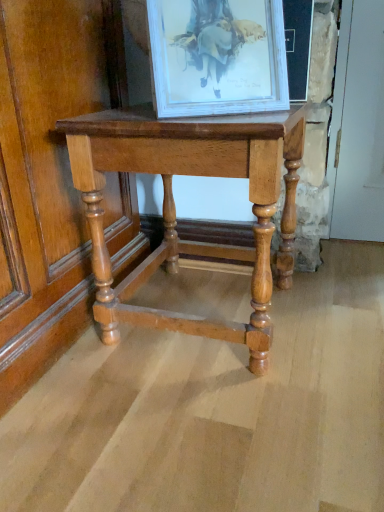
Question: In terms of size, does polished wood table at center appear bigger or smaller than white glossy picture frame at upper center?

Choices:
 (A) small
 (B) big

Answer: (B)

Question: From the image's perspective, is polished wood table at center located above or below white glossy picture frame at upper center?

Choices:
 (A) below
 (B) above

Answer: (A)

Question: Is polished wood table at center to the left or to the right of white glossy picture frame at upper center in the image?

Choices:
 (A) left
 (B) right

Answer: (A)

Question: Relative to polished wood table at center, is white glossy picture frame at upper center in front or behind?

Choices:
 (A) front
 (B) behind

Answer: (A)

Question: Considering the positions of white glossy picture frame at upper center and polished wood table at center in the image, is white glossy picture frame at upper center wider or thinner than polished wood table at center?

Choices:
 (A) thin
 (B) wide

Answer: (A)

Question: Considering the relative positions of white glossy picture frame at upper center and polished wood table at center in the image provided, is white glossy picture frame at upper center to the left or to the right of polished wood table at center?

Choices:
 (A) right
 (B) left

Answer: (A)

Question: From the image's perspective, is white glossy picture frame at upper center positioned above or below polished wood table at center?

Choices:
 (A) below
 (B) above

Answer: (B)